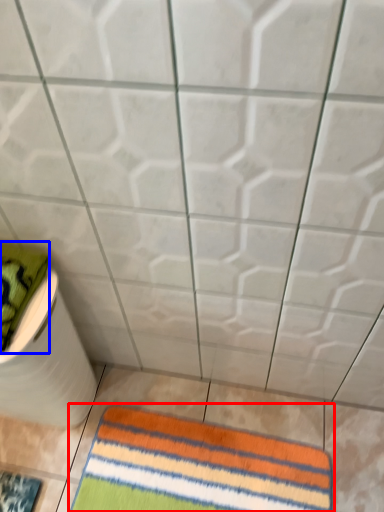
Question: Which point is further to the camera, towel (highlighted by a red box) or beach towel (highlighted by a blue box)?

Choices:
 (A) towel
 (B) beach towel

Answer: (A)